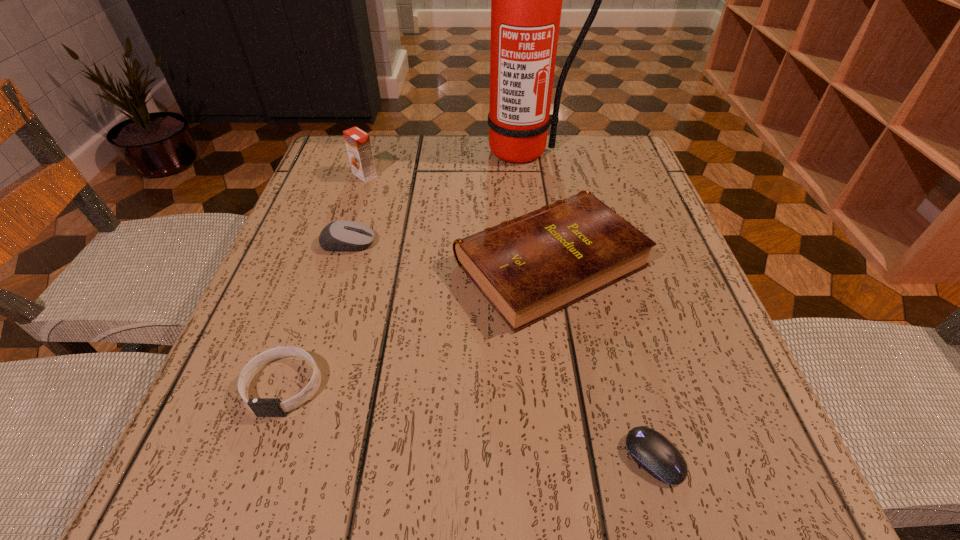
Identify the location of empty space between the orange juice and the taller computer mouse. (356, 209).

Locate an element on the screen. free space between the fifth nearest object and the second nearest object is located at coordinates (324, 280).

At what (x,y) coordinates should I click in order to perform the action: click on free area in between the wristband and the taller computer mouse. Please return your answer as a coordinate pair (x, y). Looking at the image, I should click on (316, 314).

Identify the location of free spot between the tallest object and the orange juice. This screenshot has width=960, height=540. tap(444, 163).

Point out which object is positioned as the second nearest to the second nearest object. Please provide its 2D coordinates. Your answer should be formatted as a tuple, i.e. [(x, y)], where the tuple contains the x and y coordinates of a point satisfying the conditions above.

[(343, 235)]

Locate which object ranks fifth in proximity to the wristband. Please provide its 2D coordinates. Your answer should be formatted as a tuple, i.e. [(x, y)], where the tuple contains the x and y coordinates of a point satisfying the conditions above.

[(526, 0)]

The width and height of the screenshot is (960, 540). I want to click on vacant area in the image that satisfies the following two spatial constraints: 1. on the outer surface of the wristband; 2. on the right side of the right computer mouse, so click(258, 457).

Identify the location of vacant space that satisfies the following two spatial constraints: 1. on the wheel side of the taller computer mouse; 2. on the outer surface of the second nearest object. Image resolution: width=960 pixels, height=540 pixels. (303, 386).

Where is `vacant area in the image that satisfies the following two spatial constraints: 1. on the handle side of the fire extinguisher; 2. on the right side of the fourth shortest object`? vacant area in the image that satisfies the following two spatial constraints: 1. on the handle side of the fire extinguisher; 2. on the right side of the fourth shortest object is located at coordinates (539, 264).

Where is `free spot that satisfies the following two spatial constraints: 1. on the handle side of the fire extinguisher; 2. on the wheel side of the left computer mouse`? free spot that satisfies the following two spatial constraints: 1. on the handle side of the fire extinguisher; 2. on the wheel side of the left computer mouse is located at coordinates (536, 243).